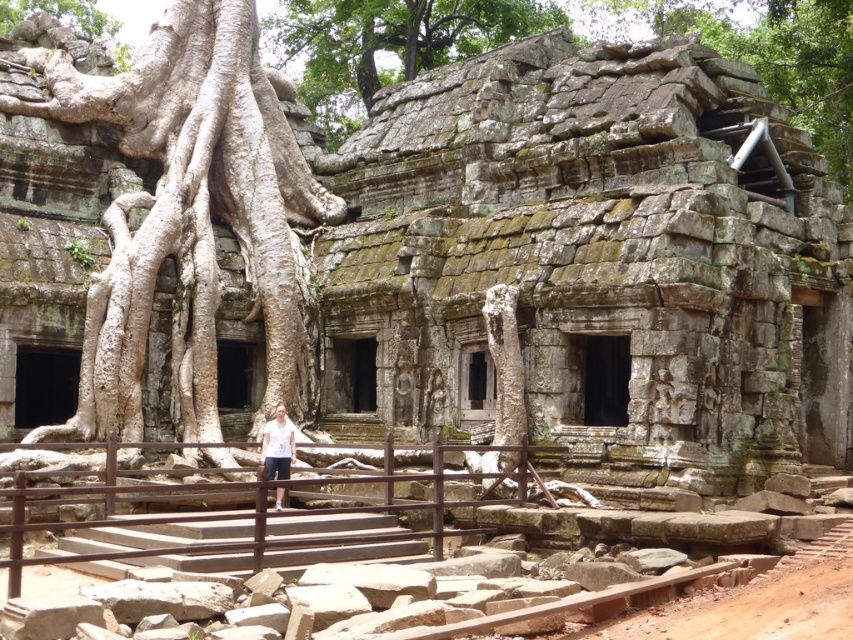
Based on the scene description, which object is taller between the white rough bark tree at center and the green mossy stone wall at upper center?

The white rough bark tree at center is taller than the green mossy stone wall at upper center according to the description.

You are an archaeologist examining the ancient stone structure. You notice a white rough bark tree at center and a white cotton shirt at center. Which object is wider?

The white rough bark tree at center is wider than the white cotton shirt at center.

You are standing at the center of the ancient stone structure and want to place a small offering at the base of the tree with coordinates point (190, 216). Can you reach the tree at those coordinates?

The point (190, 216) is on the white rough bark tree at center, so yes, you can reach the tree at those coordinates.